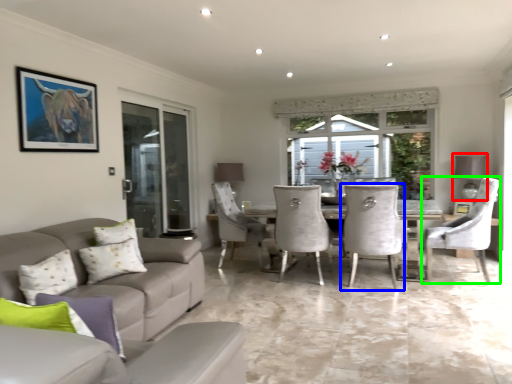
Question: Which object is the farthest from lamp (highlighted by a red box)? Choose among these: chair (highlighted by a blue box) or chair (highlighted by a green box).

Choices:
 (A) chair
 (B) chair

Answer: (A)